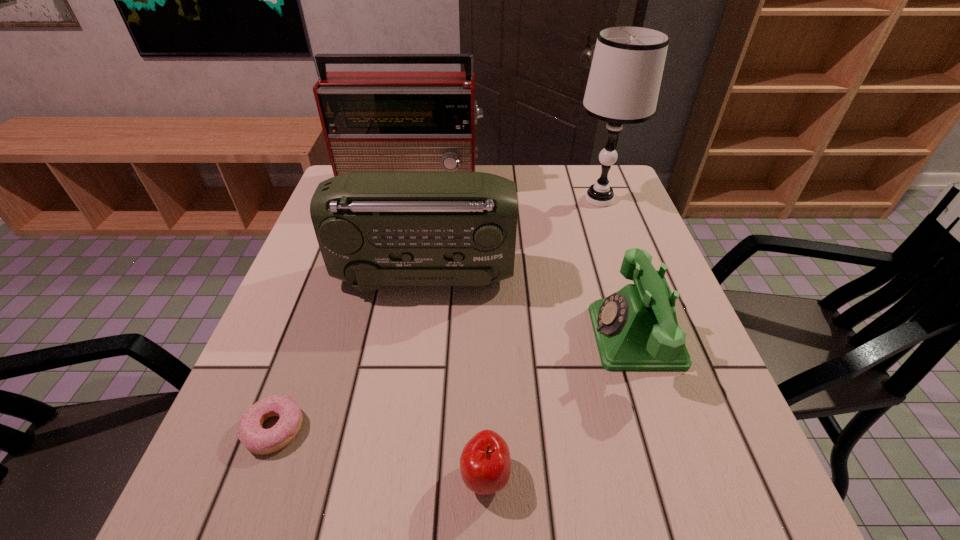
Identify the location of free area in between the third shortest object and the farther radio_receiver. This screenshot has width=960, height=540. (524, 260).

Identify the location of vacant area that lies between the shortest object and the fourth tallest object. The image size is (960, 540). (455, 383).

Locate an element on the screen. This screenshot has width=960, height=540. free point between the apple and the table lamp is located at coordinates (542, 338).

Where is `vacant space that is in between the third tallest object and the fourth tallest object`? The height and width of the screenshot is (540, 960). vacant space that is in between the third tallest object and the fourth tallest object is located at coordinates (530, 306).

At what (x,y) coordinates should I click in order to perform the action: click on vacant region between the second shortest object and the table lamp. Please return your answer as a coordinate pair (x, y). The image size is (960, 540). Looking at the image, I should click on (542, 338).

You are a GUI agent. You are given a task and a screenshot of the screen. Output one action in this format:
    pyautogui.click(x=<x>, y=<y>)
    Task: Click on the free space between the shortest object and the taller radio_receiver
    
    Given the screenshot: What is the action you would take?
    pyautogui.click(x=344, y=307)

Where is `unoccupied position between the telephone and the table lamp`? The width and height of the screenshot is (960, 540). unoccupied position between the telephone and the table lamp is located at coordinates (617, 268).

At what (x,y) coordinates should I click in order to perform the action: click on vacant area that lies between the apple and the telephone. Please return your answer as a coordinate pair (x, y). This screenshot has width=960, height=540. Looking at the image, I should click on (561, 407).

Where is `vacant point located between the shorter radio_receiver and the third shortest object`? Image resolution: width=960 pixels, height=540 pixels. vacant point located between the shorter radio_receiver and the third shortest object is located at coordinates (530, 306).

Choose which object is the nearest neighbor to the table lamp. Please provide its 2D coordinates. Your answer should be formatted as a tuple, i.e. [(x, y)], where the tuple contains the x and y coordinates of a point satisfying the conditions above.

[(374, 229)]